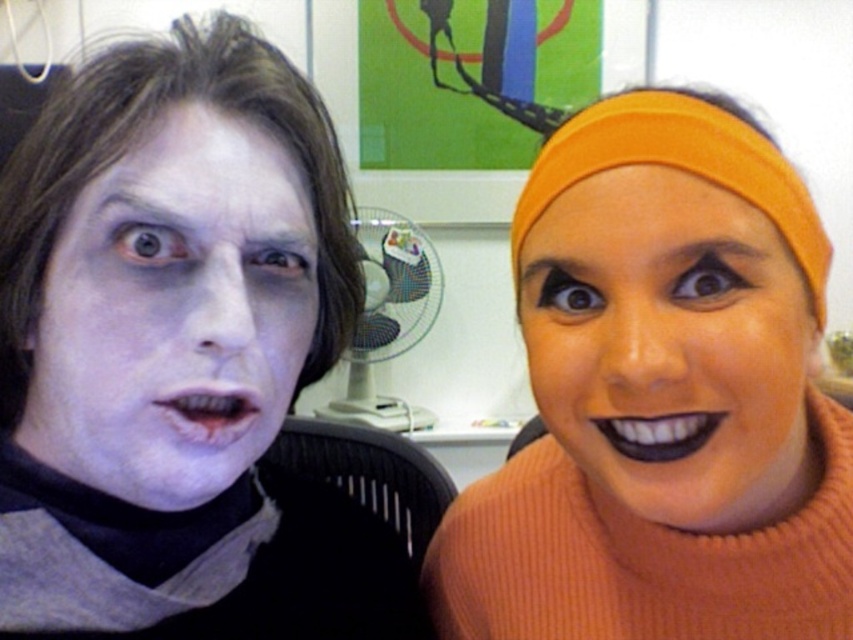
Question: Which of these objects is positioned farthest from the orange fabric headband at upper right?

Choices:
 (A) matte orange headband at upper right
 (B) pale matte face at left

Answer: (B)

Question: Does orange fabric headband at upper right appear on the left side of pale matte face at left?

Choices:
 (A) yes
 (B) no

Answer: (B)

Question: From the image, what is the correct spatial relationship of pale matte face at left in relation to matte orange headband at upper right?

Choices:
 (A) right
 (B) left

Answer: (B)

Question: Which of these objects is positioned farthest from the orange fabric headband at upper right?

Choices:
 (A) pale matte face at left
 (B) matte orange headband at upper right

Answer: (A)

Question: Can you confirm if orange fabric headband at upper right is smaller than pale matte face at left?

Choices:
 (A) yes
 (B) no

Answer: (B)

Question: Among these objects, which one is farthest from the camera?

Choices:
 (A) pale matte face at left
 (B) orange fabric headband at upper right
 (C) matte orange headband at upper right

Answer: (B)